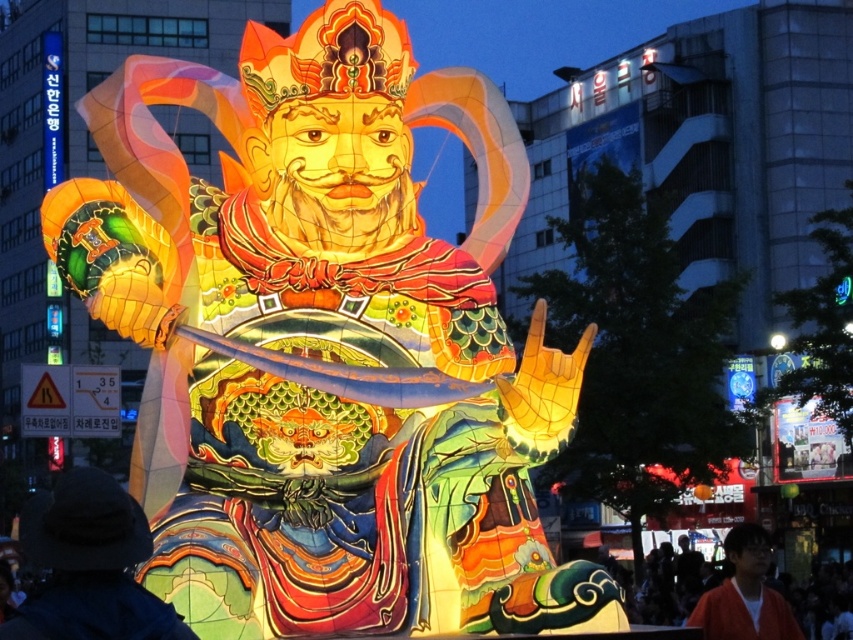
Question: Does dark blue fabric hat at lower left appear under orange fabric shirt at lower right?

Choices:
 (A) no
 (B) yes

Answer: (A)

Question: Which of the following is the farthest from the observer?

Choices:
 (A) (160, 612)
 (B) (699, 618)

Answer: (B)

Question: Is dark blue fabric hat at lower left to the left of orange fabric shirt at lower right from the viewer's perspective?

Choices:
 (A) yes
 (B) no

Answer: (A)

Question: Does dark blue fabric hat at lower left appear on the left side of orange fabric shirt at lower right?

Choices:
 (A) no
 (B) yes

Answer: (B)